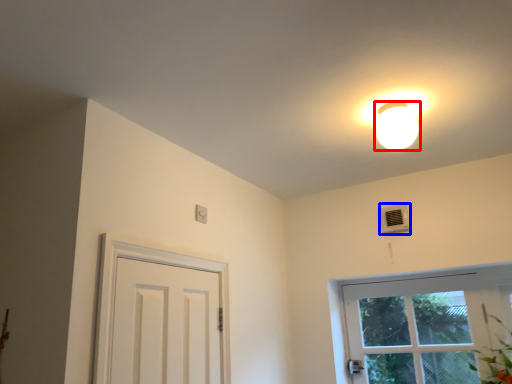
Question: Which object appears farthest to the camera in this image, lamp (highlighted by a red box) or air conditioner (highlighted by a blue box)?

Choices:
 (A) lamp
 (B) air conditioner

Answer: (B)